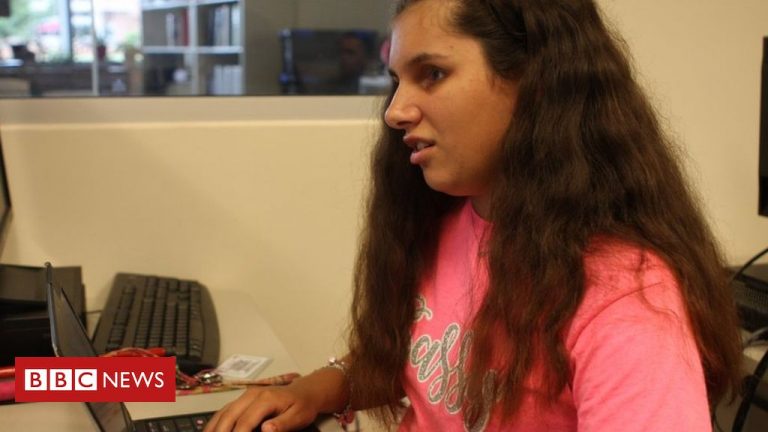
Find the location of `computer keyboard`. computer keyboard is located at coordinates (151, 327), (174, 423).